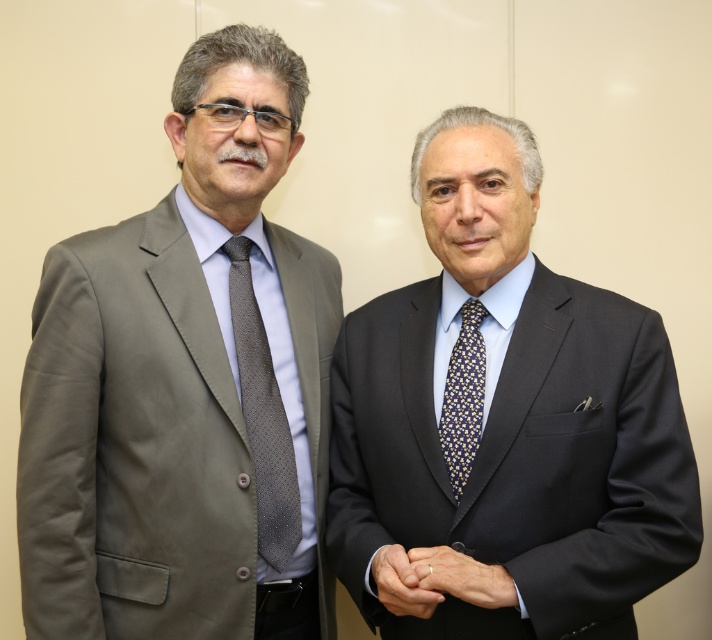
You are a photographer adjusting the camera settings for a closeup shot. You need to focus on either the gray dotted tie at left or the gold metallic ring at center. Which object should you choose to ensure the camera can capture more details due to its larger size?

The gold metallic ring at center has a larger width than the gray dotted tie at left, so focusing on the gold metallic ring at center will allow the camera to capture more details due to its bigger size.

You are a photographer setting up for a formal event. You need to ensure that the dark blue textured suit at center and the blue dotted silk tie at center are both visible in the frame. Given their sizes, which item might require more careful positioning to avoid being obscured?

The dark blue textured suit at center is bigger than the blue dotted silk tie at center, so the larger suit may require more careful positioning to ensure it doesn not block the smaller tie.

You are a photographer setting up for a group photo. You notice the dark blue textured suit at center and the blue dotted silk tie at center. Which object is closer to the camera?

The dark blue textured suit at center is closer to the camera because it is in front of the blue dotted silk tie at center.